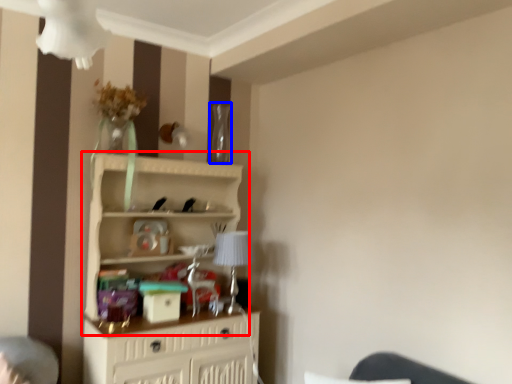
Question: Which of the following is the farthest to the observer, shelf (highlighted by a red box) or glass vase (highlighted by a blue box)?

Choices:
 (A) shelf
 (B) glass vase

Answer: (B)